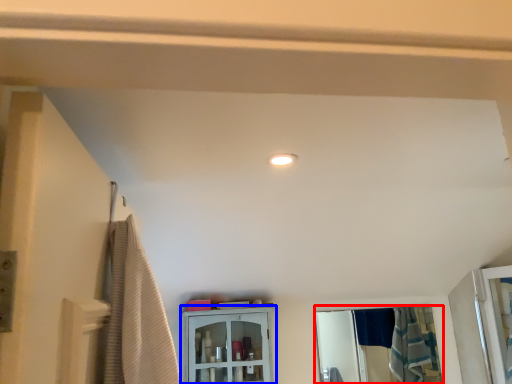
Question: Which of the following is the closest to the observer, mirror (highlighted by a red box) or cabinetry (highlighted by a blue box)?

Choices:
 (A) mirror
 (B) cabinetry

Answer: (B)